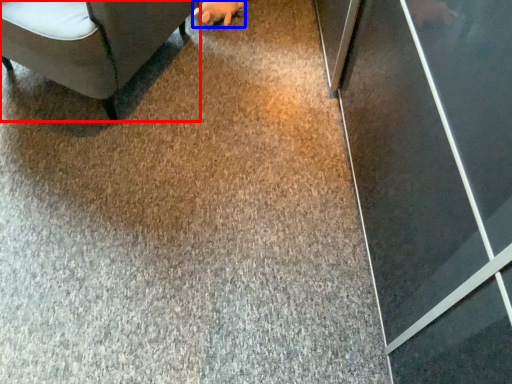
Question: Among these objects, which one is farthest to the camera, furniture (highlighted by a red box) or hand (highlighted by a blue box)?

Choices:
 (A) furniture
 (B) hand

Answer: (B)